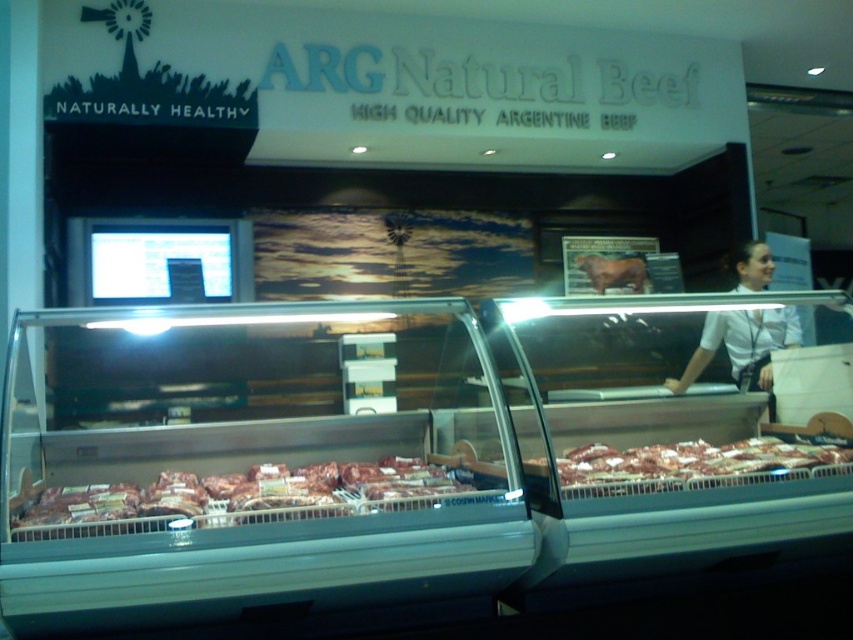
Can you confirm if red meat at center is thinner than raw red meat at center?

Incorrect, red meat at center's width is not less than raw red meat at center's.

Does point (32, 506) come closer to viewer compared to point (817, 454)?

That is True.

Is point (267, 490) positioned in front of point (666, 486)?

Yes.

At what (x,y) coordinates should I click in order to perform the action: click on red meat at center. Please return your answer as a coordinate pair (x, y). The height and width of the screenshot is (640, 853). Looking at the image, I should click on tap(236, 497).

Who is lower down, red meat at center or white shirt at upper right?

Positioned lower is red meat at center.

Describe the element at coordinates (236, 497) in the screenshot. I see `red meat at center` at that location.

This screenshot has height=640, width=853. I want to click on red meat at center, so click(x=236, y=497).

Based on the photo, is raw red meat at center to the left of white shirt at upper right from the viewer's perspective?

Correct, you'll find raw red meat at center to the left of white shirt at upper right.

Which is above, raw red meat at center or white shirt at upper right?

Positioned higher is white shirt at upper right.

This screenshot has height=640, width=853. Describe the element at coordinates (694, 464) in the screenshot. I see `raw red meat at center` at that location.

Find the location of a particular element. raw red meat at center is located at coordinates click(x=694, y=464).